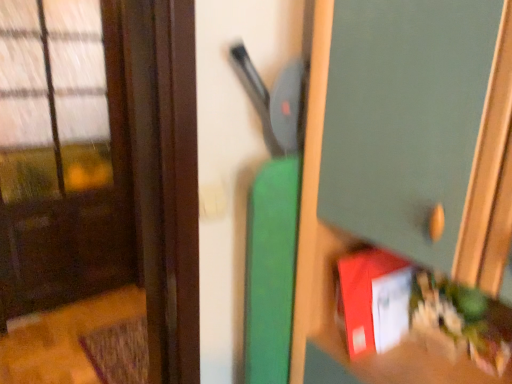
Question: Is red matte book at lower right, which is counted as the first book, starting from the right, bigger than green matte cabinet at center?

Choices:
 (A) no
 (B) yes

Answer: (A)

Question: Is red matte book at lower right, which is counted as the 2th book, starting from the left, placed right next to green matte cabinet at center?

Choices:
 (A) no
 (B) yes

Answer: (A)

Question: From the image's perspective, is red matte book at lower right, which is counted as the first book, starting from the right, below green matte cabinet at center?

Choices:
 (A) yes
 (B) no

Answer: (A)

Question: Can you confirm if red matte book at lower right, which is counted as the 2th book, starting from the left, is smaller than green matte cabinet at center?

Choices:
 (A) yes
 (B) no

Answer: (A)

Question: Considering the relative sizes of red matte book at lower right, which is counted as the first book, starting from the right, and green matte cabinet at center in the image provided, is red matte book at lower right, which is counted as the first book, starting from the right, thinner than green matte cabinet at center?

Choices:
 (A) no
 (B) yes

Answer: (B)

Question: Does red matte book at lower right, which is counted as the 2th book, starting from the left, have a lesser height compared to green matte cabinet at center?

Choices:
 (A) no
 (B) yes

Answer: (B)

Question: Is green matte cabinet at center wider than matte red book at lower right, the 2th book positioned from the right?

Choices:
 (A) no
 (B) yes

Answer: (B)

Question: Does green matte cabinet at center come in front of matte red book at lower right, the 1th book positioned from the left?

Choices:
 (A) no
 (B) yes

Answer: (B)

Question: Can you see green matte cabinet at center touching matte red book at lower right, the 1th book positioned from the left?

Choices:
 (A) no
 (B) yes

Answer: (A)

Question: Is green matte cabinet at center at the left side of matte red book at lower right, the 1th book positioned from the left?

Choices:
 (A) no
 (B) yes

Answer: (A)

Question: Does green matte cabinet at center have a larger size compared to matte red book at lower right, the 2th book positioned from the right?

Choices:
 (A) no
 (B) yes

Answer: (B)

Question: From a real-world perspective, is green matte cabinet at center on matte red book at lower right, the 1th book positioned from the left?

Choices:
 (A) no
 (B) yes

Answer: (B)

Question: Can you confirm if red matte book at lower right, which is counted as the 2th book, starting from the left, is positioned to the left of brown matte door at left?

Choices:
 (A) no
 (B) yes

Answer: (A)